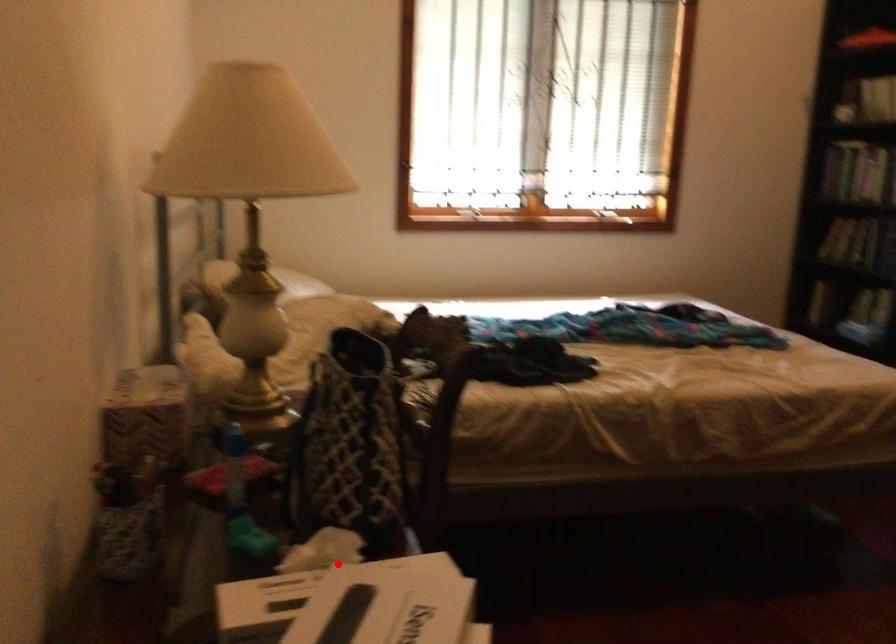
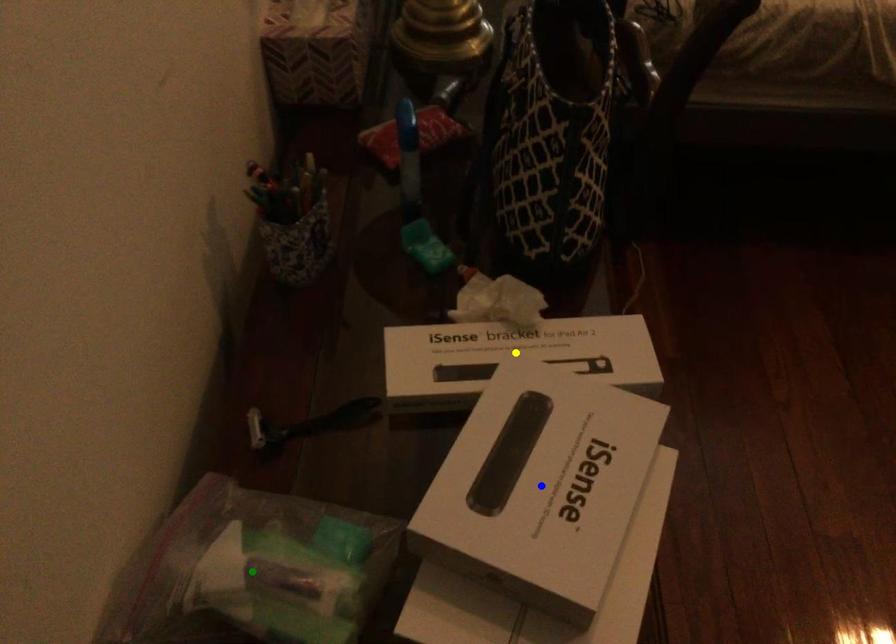
Question: I am providing you with two images of the same scene from different viewpoints. A red point is marked on the first image. You are given multiple points on the second image. Which mark in image 2 goes with the point in image 1?

Choices:
 (A) green point
 (B) blue point
 (C) yellow point

Answer: (C)